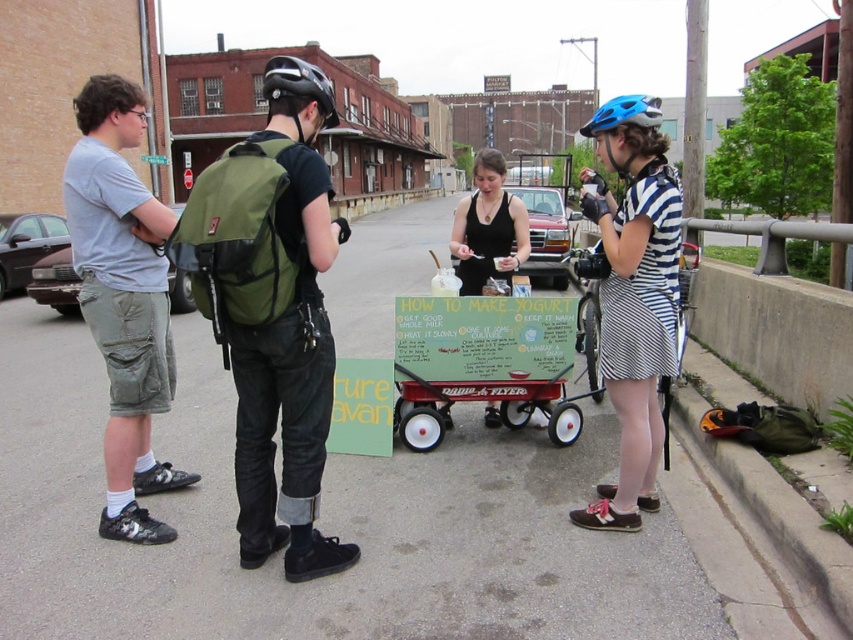
You are a photographer standing near the red wagon and want to take a photo of the striped cotton dress at right and the blue matte bicycle helmet at upper right. Which object will appear larger in the photo?

The striped cotton dress at right will appear larger in the photo because it is closer to the viewer than the blue matte bicycle helmet at upper right.